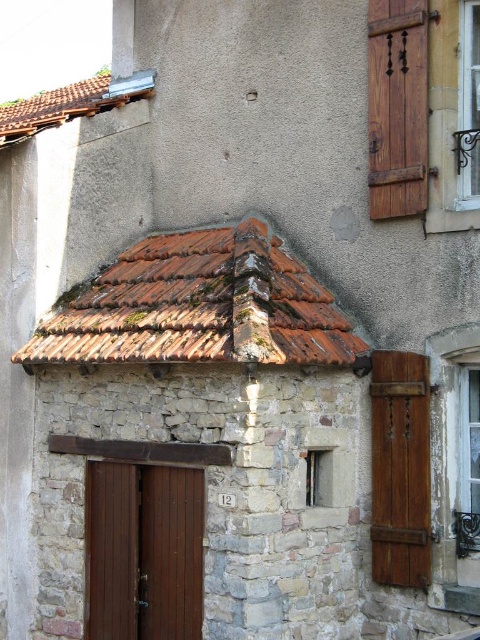
You are standing in front of the rustic structure and want to enter through the brown wooden door at lower left. To do so, you need to ensure there is enough space between the door and the wooden shutter at upper right. Is the distance sufficient for you to open the door without hitting the shutter?

The brown wooden door at lower left is below the wooden shutter at upper right, so opening the door should be possible without hitting the shutter as they are vertically aligned with the door positioned lower than the shutter.